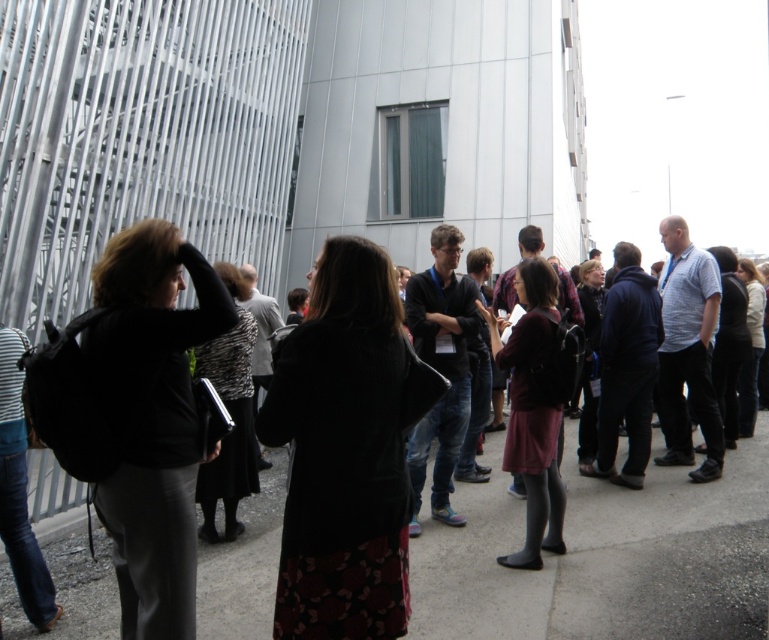
Question: Which object is the farthest from the dark gray sweater at center?

Choices:
 (A) black wool coat at center
 (B) matte black jacket at left

Answer: (A)

Question: Which object is the farthest from the matte black jacket at left?

Choices:
 (A) dark gray sweater at center
 (B) black wool coat at center

Answer: (A)

Question: Which point is farther to the camera?

Choices:
 (A) matte black jacket at left
 (B) black wool coat at center

Answer: (A)

Question: Can you confirm if black wool coat at center is smaller than matte black jacket at left?

Choices:
 (A) yes
 (B) no

Answer: (A)

Question: Does black wool coat at center appear over matte black jacket at left?

Choices:
 (A) yes
 (B) no

Answer: (A)

Question: Can you confirm if dark gray sweater at center is wider than black wool coat at center?

Choices:
 (A) no
 (B) yes

Answer: (B)